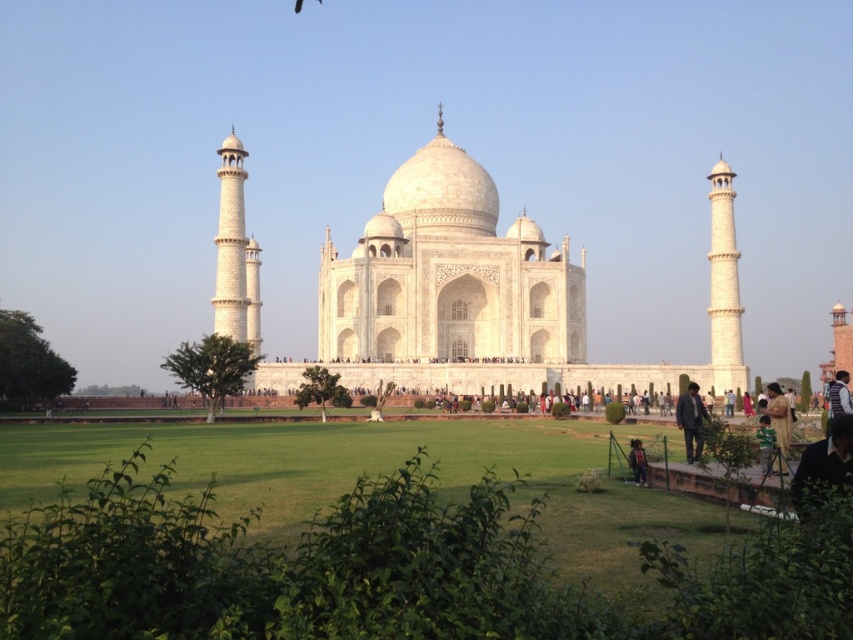
You are a tourist standing in front of the Taj Mahal and notice the green grass at center and the dark brown leather jacket at lower right. Which object is nearer to you?

The green grass at center is closer to the viewer than the dark brown leather jacket at lower right.

You are a photographer planning to capture the Taj Mahal with the yellow fabric dress at lower right and the green fabric person at lower right in the frame. Which object should you focus on first if you want to ensure both are in focus, considering their sizes?

The yellow fabric dress at lower right has a larger size compared to the green fabric person at lower right. To ensure both are in focus, you should focus on the yellow fabric dress at lower right first since it is larger and closer to the camera, which will help maintain sharpness for both subjects.